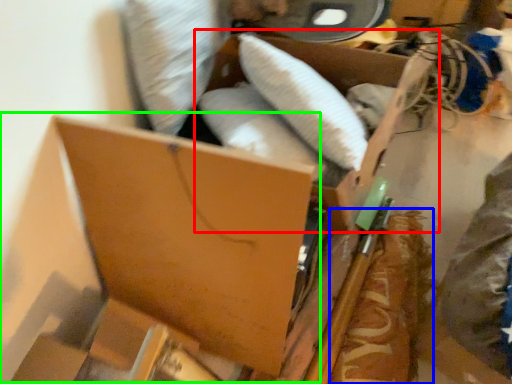
Question: Which object is positioned closest to storage box (highlighted by a red box)? Select from food (highlighted by a blue box) and storage box (highlighted by a green box).

Choices:
 (A) food
 (B) storage box

Answer: (A)